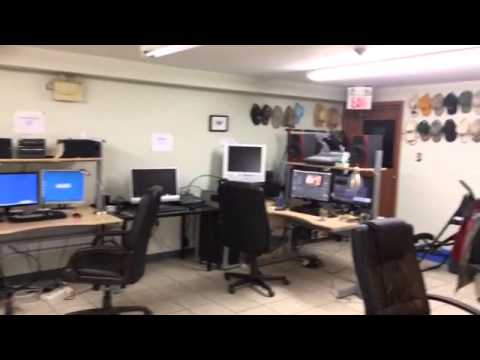
Locate an element on the screen. The image size is (480, 360). computer chairs is located at coordinates [x=152, y=222], [x=240, y=224], [x=386, y=268].